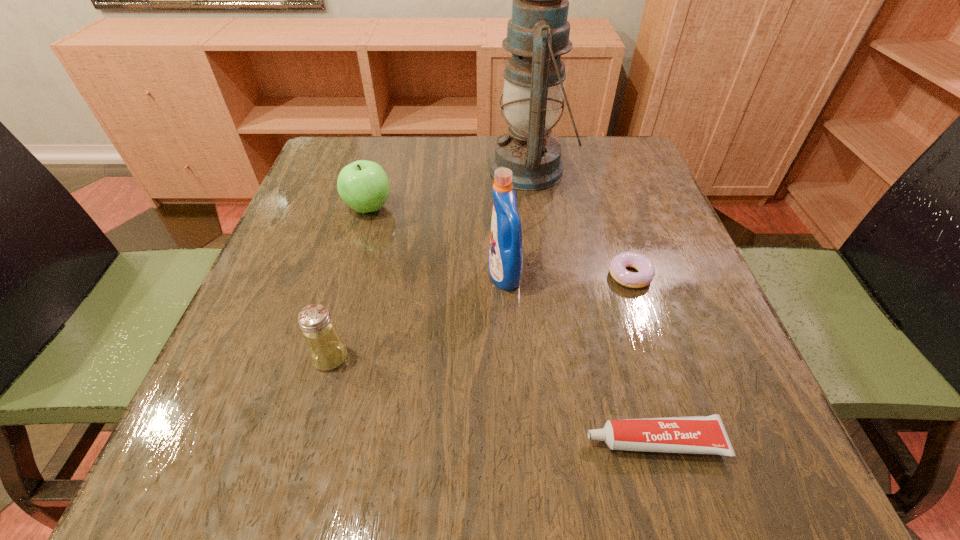
Identify the location of unoccupied position between the nearest object and the oil lamp. (592, 305).

This screenshot has height=540, width=960. What are the coordinates of `empty space between the second tallest object and the second shortest object` in the screenshot? It's located at coord(579,358).

Where is `free space between the detergent and the doughnut`? The height and width of the screenshot is (540, 960). free space between the detergent and the doughnut is located at coordinates (567, 275).

Locate an element on the screen. This screenshot has width=960, height=540. vacant area between the nearest object and the apple is located at coordinates (512, 324).

This screenshot has height=540, width=960. Identify the location of unoccupied position between the apple and the fifth farthest object. (349, 282).

Identify the location of vacant area between the fifth shortest object and the shortest object. This screenshot has width=960, height=540. (567, 275).

Locate an element on the screen. The width and height of the screenshot is (960, 540). free space between the nearest object and the apple is located at coordinates (512, 324).

Locate an element on the screen. Image resolution: width=960 pixels, height=540 pixels. free space between the fifth farthest object and the second shortest object is located at coordinates (492, 399).

Locate which object is the closest to the fifth tallest object. Please provide its 2D coordinates. Your answer should be formatted as a tuple, i.e. [(x, y)], where the tuple contains the x and y coordinates of a point satisfying the conditions above.

[(505, 261)]

This screenshot has height=540, width=960. Identify the location of the closest object to the apple. (538, 33).